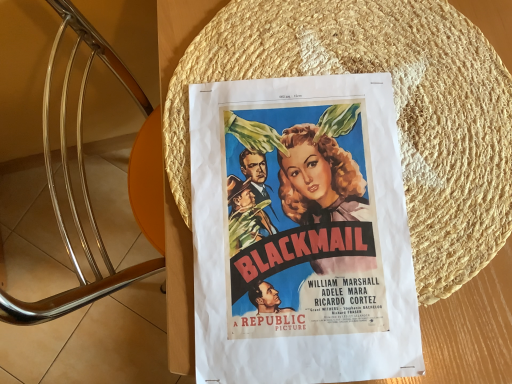
Find the location of a particular element. empty space that is ontop of matte paper poster at center (from a real-world perspective) is located at coordinates (304, 222).